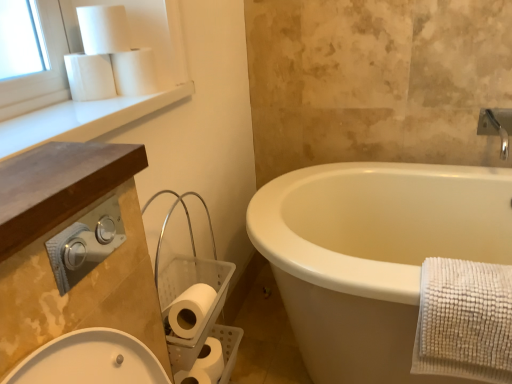
At what (x,y) coordinates should I click in order to perform the action: click on white matte toilet paper at upper left, arranged as the second toilet paper when viewed from the top. Please return your answer as a coordinate pair (x, y). The height and width of the screenshot is (384, 512). Looking at the image, I should click on (134, 72).

At what (x,y) coordinates should I click in order to perform the action: click on white matte toilet paper at upper left, acting as the 5th toilet paper starting from the bottom. Please return your answer as a coordinate pair (x, y). Image resolution: width=512 pixels, height=384 pixels. Looking at the image, I should click on (103, 29).

The width and height of the screenshot is (512, 384). Find the location of `white matte toilet paper at upper left, acting as the third toilet paper starting from the top`. white matte toilet paper at upper left, acting as the third toilet paper starting from the top is located at coordinates (90, 77).

Measure the distance between point (190, 330) and camera.

The distance of point (190, 330) from camera is 39.09 inches.

Describe the element at coordinates (464, 320) in the screenshot. This screenshot has height=384, width=512. I see `white textured bath towel at right` at that location.

You are a GUI agent. You are given a task and a screenshot of the screen. Output one action in this format:
    pyautogui.click(x=<x>, y=<y>)
    Task: Click on the white matte toilet paper at upper left, arranged as the second toilet paper when viewed from the top
    
    Given the screenshot: What is the action you would take?
    pyautogui.click(x=134, y=72)

Can you confirm if silver metallic towel bar at left is positioned to the left of brown wood countertop at upper left?

No, silver metallic towel bar at left is not to the left of brown wood countertop at upper left.

Is silver metallic towel bar at left outside of brown wood countertop at upper left?

Yes.

Is silver metallic towel bar at left facing away from brown wood countertop at upper left?

No, brown wood countertop at upper left is not at the back of silver metallic towel bar at left.

Considering the sizes of objects silver metallic towel bar at left and brown wood countertop at upper left in the image provided, who is thinner, silver metallic towel bar at left or brown wood countertop at upper left?

Thinner between the two is silver metallic towel bar at left.

Is point (208, 373) positioned before point (96, 65)?

No.

From a real-world perspective, which is physically above, white matte toilet paper at lower center, the first toilet paper ordered from the bottom, or white matte toilet paper at upper left, which is the 3th toilet paper in bottom-to-top order?

From a 3D spatial view, white matte toilet paper at upper left, which is the 3th toilet paper in bottom-to-top order, is above.

Based on their positions, is white matte toilet paper at lower center, acting as the fifth toilet paper starting from the top, located to the left or right of white matte toilet paper at upper left, acting as the third toilet paper starting from the top?

white matte toilet paper at lower center, acting as the fifth toilet paper starting from the top, is to the right of white matte toilet paper at upper left, acting as the third toilet paper starting from the top.

Is white matte toilet paper at lower center, acting as the fifth toilet paper starting from the top, located outside white matte toilet paper at upper left, acting as the third toilet paper starting from the top?

Indeed, white matte toilet paper at lower center, acting as the fifth toilet paper starting from the top, is completely outside white matte toilet paper at upper left, acting as the third toilet paper starting from the top.

Visually, is white matte toilet paper at upper left, acting as the 5th toilet paper starting from the bottom, positioned to the left or to the right of white smooth window sill at upper left?

In the image, white matte toilet paper at upper left, acting as the 5th toilet paper starting from the bottom, appears on the right side of white smooth window sill at upper left.

Does white matte toilet paper at upper left, acting as the 5th toilet paper starting from the bottom, have a larger size compared to white smooth window sill at upper left?

No.

Is white matte toilet paper at upper left, acting as the 5th toilet paper starting from the bottom, inside the boundaries of white smooth window sill at upper left, or outside?

white matte toilet paper at upper left, acting as the 5th toilet paper starting from the bottom, cannot be found inside white smooth window sill at upper left.

Consider the image. From the image's perspective, between white matte toilet paper at upper left, acting as the 5th toilet paper starting from the bottom, and white smooth window sill at upper left, who is located below?

white smooth window sill at upper left appears lower in the image.

Choose the correct answer: Is white smooth window sill at upper left inside white matte toilet paper at upper left, arranged as the 1th toilet paper when viewed from the top, or outside it?

white smooth window sill at upper left lies outside white matte toilet paper at upper left, arranged as the 1th toilet paper when viewed from the top.

What are the coordinates of `window sill below the white matte toilet paper at upper left, acting as the 5th toilet paper starting from the bottom (from the image's perspective)` in the screenshot? It's located at (81, 119).

From a real-world perspective, is white smooth window sill at upper left located higher than white matte toilet paper at upper left, arranged as the 1th toilet paper when viewed from the top?

No, from a real-world perspective, white smooth window sill at upper left is not above white matte toilet paper at upper left, arranged as the 1th toilet paper when viewed from the top.

Which object is wider, white smooth window sill at upper left or white matte toilet paper at upper left, arranged as the 1th toilet paper when viewed from the top?

white smooth window sill at upper left.

Does white matte toilet paper at upper left, arranged as the second toilet paper when viewed from the top, contain white smooth window sill at upper left?

That's incorrect, white smooth window sill at upper left is not inside white matte toilet paper at upper left, arranged as the second toilet paper when viewed from the top.

There is a white smooth window sill at upper left. Identify the location of the 1st toilet paper above it (from a real-world perspective). This screenshot has width=512, height=384. (134, 72).

From their relative heights in the image, would you say white matte toilet paper at upper left, which is the 4th toilet paper from bottom to top, is taller or shorter than white smooth window sill at upper left?

Clearly, white matte toilet paper at upper left, which is the 4th toilet paper from bottom to top, is taller compared to white smooth window sill at upper left.

Is white matte toilet paper at upper left, arranged as the second toilet paper when viewed from the top, looking in the opposite direction of white smooth window sill at upper left?

That's not correct — white matte toilet paper at upper left, arranged as the second toilet paper when viewed from the top, is not looking away from white smooth window sill at upper left.

Is white matte toilet paper at upper left, arranged as the second toilet paper when viewed from the top, not close to white matte toilet paper at lower left, the 4th toilet paper from the top?

Actually, white matte toilet paper at upper left, arranged as the second toilet paper when viewed from the top, and white matte toilet paper at lower left, the 4th toilet paper from the top, are a little close together.

From a real-world perspective, which is physically below, white matte toilet paper at upper left, arranged as the second toilet paper when viewed from the top, or white matte toilet paper at lower left, which is the 2th toilet paper in bottom-to-top order?

white matte toilet paper at lower left, which is the 2th toilet paper in bottom-to-top order.

Starting from the white matte toilet paper at lower left, which is the 2th toilet paper in bottom-to-top order, which toilet paper is the 3rd one behind? Please provide its 2D coordinates.

[(134, 72)]

From the picture: How many degrees apart are the facing directions of white matte toilet paper at upper left, which is the 4th toilet paper from bottom to top, and white matte toilet paper at lower left, which is the 2th toilet paper in bottom-to-top order?

0.0705 degrees separate the facing orientations of white matte toilet paper at upper left, which is the 4th toilet paper from bottom to top, and white matte toilet paper at lower left, which is the 2th toilet paper in bottom-to-top order.

Is silver metallic towel bar at left to the left or to the right of white matte toilet paper at lower center, the first toilet paper ordered from the bottom, in the image?

Clearly, silver metallic towel bar at left is on the left of white matte toilet paper at lower center, the first toilet paper ordered from the bottom, in the image.

Is silver metallic towel bar at left next to white matte toilet paper at lower center, acting as the fifth toilet paper starting from the top, and touching it?

No.

From the image's perspective, is silver metallic towel bar at left below white matte toilet paper at lower center, the first toilet paper ordered from the bottom?

No, from the image's perspective, silver metallic towel bar at left is not beneath white matte toilet paper at lower center, the first toilet paper ordered from the bottom.

Looking at this image, how far apart are silver metallic towel bar at left and white matte toilet paper at lower center, the first toilet paper ordered from the bottom?

A distance of 17.26 inches exists between silver metallic towel bar at left and white matte toilet paper at lower center, the first toilet paper ordered from the bottom.

The width and height of the screenshot is (512, 384). I want to click on counter top located in front of the silver metallic towel bar at left, so click(58, 186).

Locate an element on the screen. the 2nd toilet paper behind the white matte toilet paper at upper left, acting as the third toilet paper starting from the top is located at coordinates (204, 365).

Based on their spatial positions, is white textured bath towel at right or white matte toilet paper at upper left, which is the 4th toilet paper from bottom to top, further from white matte toilet paper at lower left, which is the 2th toilet paper in bottom-to-top order?

The object further to white matte toilet paper at lower left, which is the 2th toilet paper in bottom-to-top order, is white textured bath towel at right.

Which object lies nearer to the anchor point white matte toilet paper at upper left, which is the 4th toilet paper from bottom to top, white matte toilet paper at upper left, acting as the third toilet paper starting from the top, or white textured bath towel at right?

white matte toilet paper at upper left, acting as the third toilet paper starting from the top, is positioned closer to the anchor white matte toilet paper at upper left, which is the 4th toilet paper from bottom to top.

Looking at the image, which one is located closer to white matte toilet paper at lower center, acting as the fifth toilet paper starting from the top, white matte toilet paper at upper left, which is the 3th toilet paper in bottom-to-top order, or brown wood countertop at upper left?

Based on the image, brown wood countertop at upper left appears to be nearer to white matte toilet paper at lower center, acting as the fifth toilet paper starting from the top.

Based on their spatial positions, is white matte toilet paper at lower left, which is the 2th toilet paper in bottom-to-top order, or brown wood countertop at upper left further from white matte toilet paper at lower center, acting as the fifth toilet paper starting from the top?

Based on the image, brown wood countertop at upper left appears to be further to white matte toilet paper at lower center, acting as the fifth toilet paper starting from the top.

Considering their positions, is white textured bath towel at right positioned closer to silver metallic towel bar at left than white matte toilet paper at upper left, which is the 4th toilet paper from bottom to top?

The object closer to silver metallic towel bar at left is white matte toilet paper at upper left, which is the 4th toilet paper from bottom to top.

Estimate the real-world distances between objects in this image. Which object is further from white matte toilet paper at lower center, acting as the fifth toilet paper starting from the top, white matte toilet paper at upper left, arranged as the 1th toilet paper when viewed from the top, or silver metallic towel bar at left?

white matte toilet paper at upper left, arranged as the 1th toilet paper when viewed from the top, is positioned further to the anchor white matte toilet paper at lower center, acting as the fifth toilet paper starting from the top.

In the scene shown: Looking at the image, which one is located closer to white matte toilet paper at lower center, acting as the fifth toilet paper starting from the top, white matte toilet paper at upper left, arranged as the second toilet paper when viewed from the top, or white matte toilet paper at lower left, the 4th toilet paper from the top?

white matte toilet paper at lower left, the 4th toilet paper from the top.

Based on their spatial positions, is white matte toilet paper at lower center, the first toilet paper ordered from the bottom, or white matte toilet paper at upper left, arranged as the second toilet paper when viewed from the top, closer to white matte toilet paper at lower left, the 4th toilet paper from the top?

white matte toilet paper at lower center, the first toilet paper ordered from the bottom, is positioned closer to the anchor white matte toilet paper at lower left, the 4th toilet paper from the top.

Find the location of a particular element. Image resolution: width=512 pixels, height=384 pixels. towel bar between brown wood countertop at upper left and white matte toilet paper at upper left, arranged as the second toilet paper when viewed from the top, in the front-back direction is located at coordinates (85, 244).

The height and width of the screenshot is (384, 512). Identify the location of window sill between white matte toilet paper at upper left, arranged as the 1th toilet paper when viewed from the top, and white matte toilet paper at lower center, acting as the fifth toilet paper starting from the top, from top to bottom. (81, 119).

Identify the location of window sill between white matte toilet paper at upper left, acting as the 5th toilet paper starting from the bottom, and white matte toilet paper at lower left, which is the 2th toilet paper in bottom-to-top order, vertically. This screenshot has height=384, width=512. (81, 119).

What are the coordinates of `towel bar between white matte toilet paper at upper left, acting as the 5th toilet paper starting from the bottom, and white matte toilet paper at lower center, acting as the fifth toilet paper starting from the top, from top to bottom` in the screenshot? It's located at (85, 244).